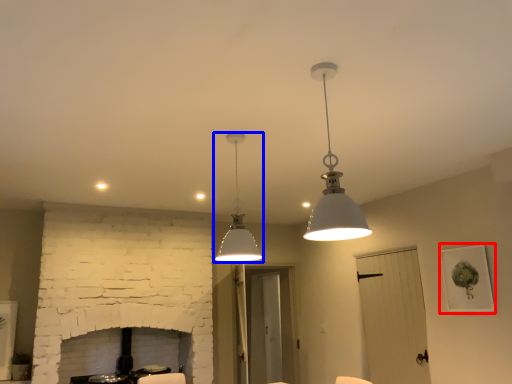
Question: Which of the following is the closest to the observer, picture frame (highlighted by a red box) or lamp (highlighted by a blue box)?

Choices:
 (A) picture frame
 (B) lamp

Answer: (B)